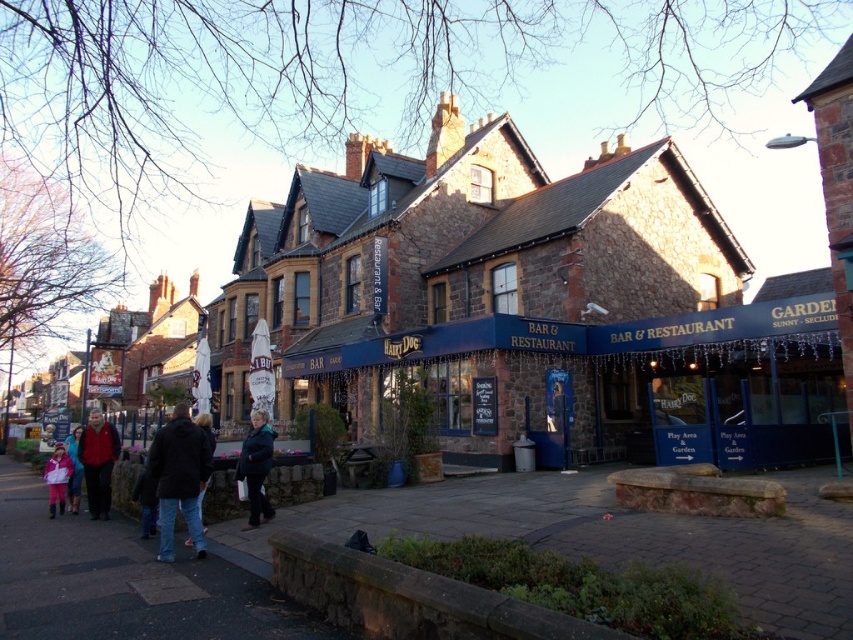
Question: Which is farther from the dark gray concrete pavement at lower left?

Choices:
 (A) stone building at center
 (B) smooth concrete pavement at lower center
 (C) dark blue jacket at center
 (D) dark blue jacket at lower left

Answer: (A)

Question: Based on their relative distances, which object is farther from the red wool coat at lower left?

Choices:
 (A) matte black jacket at lower left
 (B) smooth concrete pavement at lower center

Answer: (B)

Question: Where is stone building at center located in relation to matte black jacket at lower left in the image?

Choices:
 (A) below
 (B) above

Answer: (B)

Question: Is red wool coat at lower left below light pink fabric at lower left?

Choices:
 (A) no
 (B) yes

Answer: (B)

Question: In this image, where is dark blue jacket at lower left located relative to dark blue jacket at center?

Choices:
 (A) left
 (B) right

Answer: (A)

Question: Considering the real-world distances, which object is farthest from the light pink fabric at lower left?

Choices:
 (A) dark blue jacket at lower left
 (B) red wool coat at lower left
 (C) matte black jacket at lower left

Answer: (A)